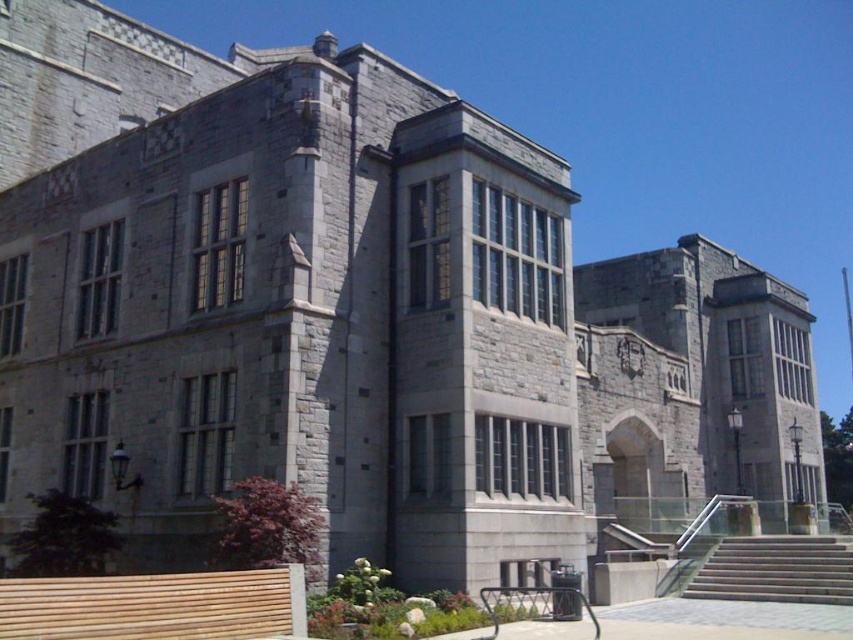
Question: Which point is farther to the camera?

Choices:
 (A) (764, 595)
 (B) (248, 608)

Answer: (A)

Question: Can you confirm if light brown wooden park bench at lower left is positioned to the left of concrete stairs at lower right?

Choices:
 (A) no
 (B) yes

Answer: (B)

Question: Does light brown wooden park bench at lower left have a smaller size compared to concrete stairs at lower right?

Choices:
 (A) no
 (B) yes

Answer: (A)

Question: Which of the following is the farthest from the observer?

Choices:
 (A) light brown wooden park bench at lower left
 (B) concrete stairs at lower right

Answer: (B)

Question: Is light brown wooden park bench at lower left above concrete stairs at lower right?

Choices:
 (A) yes
 (B) no

Answer: (A)